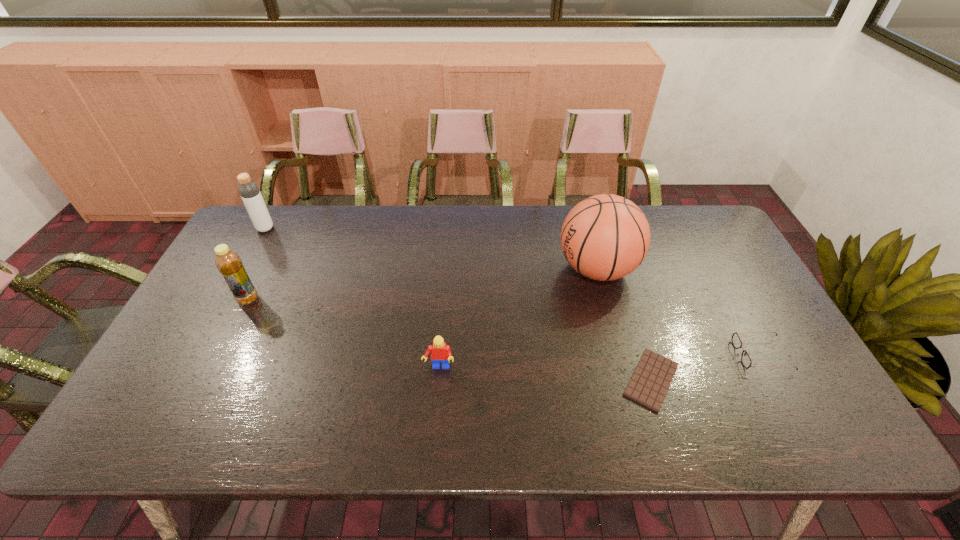
You are a GUI agent. You are given a task and a screenshot of the screen. Output one action in this format:
    pyautogui.click(x=<x>, y=<y>)
    Task: Click on the object that is the closest one to the fourth object from right to left
    The width and height of the screenshot is (960, 540).
    Given the screenshot: What is the action you would take?
    pyautogui.click(x=605, y=237)

Locate an element on the screen. This screenshot has height=540, width=960. vacant space that satisfies the following two spatial constraints: 1. on the surface of the shortest object near the brand logo; 2. on the right side of the tallest object is located at coordinates tap(627, 380).

What are the coordinates of `vacant space that satisfies the following two spatial constraints: 1. on the surface of the basketball near the brand logo; 2. on the left side of the chocolate bar` in the screenshot? It's located at (627, 380).

This screenshot has width=960, height=540. I want to click on free space that satisfies the following two spatial constraints: 1. on the front side of the nearer bottle; 2. on the right side of the farthest object, so click(x=227, y=299).

You are a GUI agent. You are given a task and a screenshot of the screen. Output one action in this format:
    pyautogui.click(x=<x>, y=<y>)
    Task: Click on the free space that satisfies the following two spatial constraints: 1. on the front-facing side of the shortest object; 2. on the left side of the third object from left to right
    The height and width of the screenshot is (540, 960).
    Given the screenshot: What is the action you would take?
    pyautogui.click(x=438, y=380)